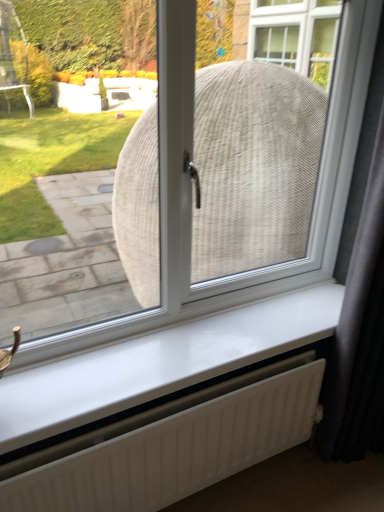
Locate an element on the screen. The height and width of the screenshot is (512, 384). free location above white matte radiator at lower center (from a real-world perspective) is located at coordinates (172, 406).